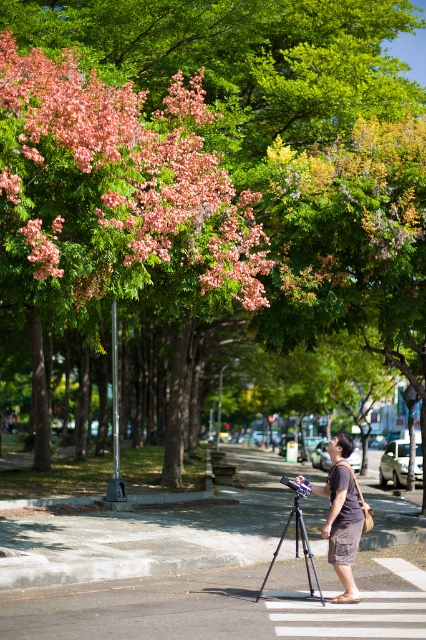
Question: Among these objects, which one is farthest from the camera?

Choices:
 (A) brown cotton shorts at lower center
 (B) black metallic tripod at center

Answer: (A)

Question: Does brown cotton shorts at lower center have a greater width compared to black metallic tripod at center?

Choices:
 (A) no
 (B) yes

Answer: (A)

Question: Is brown cotton shorts at lower center to the right of black metallic tripod at center from the viewer's perspective?

Choices:
 (A) yes
 (B) no

Answer: (A)

Question: Can you confirm if brown cotton shorts at lower center is bigger than black metallic tripod at center?

Choices:
 (A) no
 (B) yes

Answer: (A)

Question: Which point is closer to the camera?

Choices:
 (A) coord(288,522)
 (B) coord(311,486)

Answer: (B)